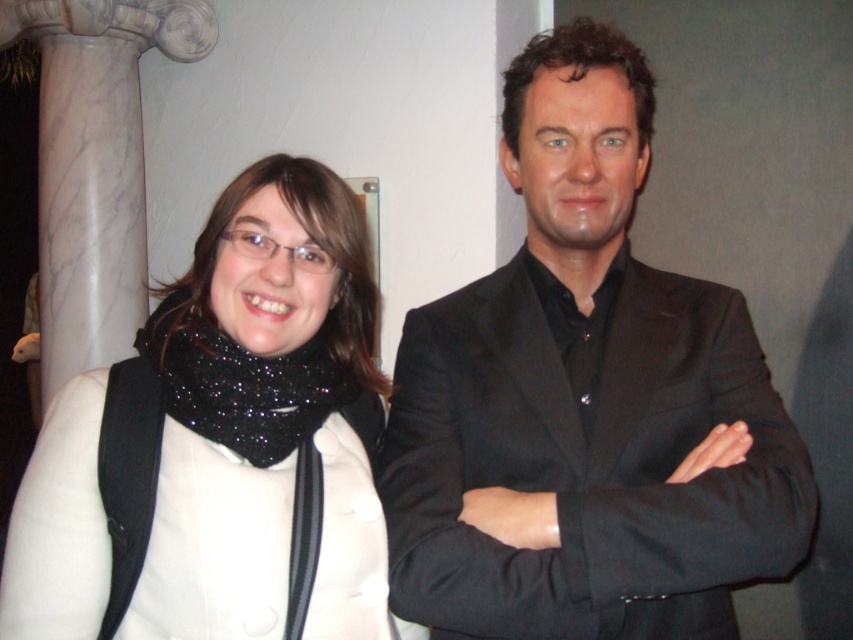
Question: Can you confirm if black matte suit at center is wider than white matte scarf at left?

Choices:
 (A) no
 (B) yes

Answer: (B)

Question: Can you confirm if black matte suit at center is thinner than white matte scarf at left?

Choices:
 (A) yes
 (B) no

Answer: (B)

Question: Does black matte suit at center come behind white matte scarf at left?

Choices:
 (A) no
 (B) yes

Answer: (B)

Question: Which point is farther to the camera?

Choices:
 (A) white matte scarf at left
 (B) black matte suit at center

Answer: (B)